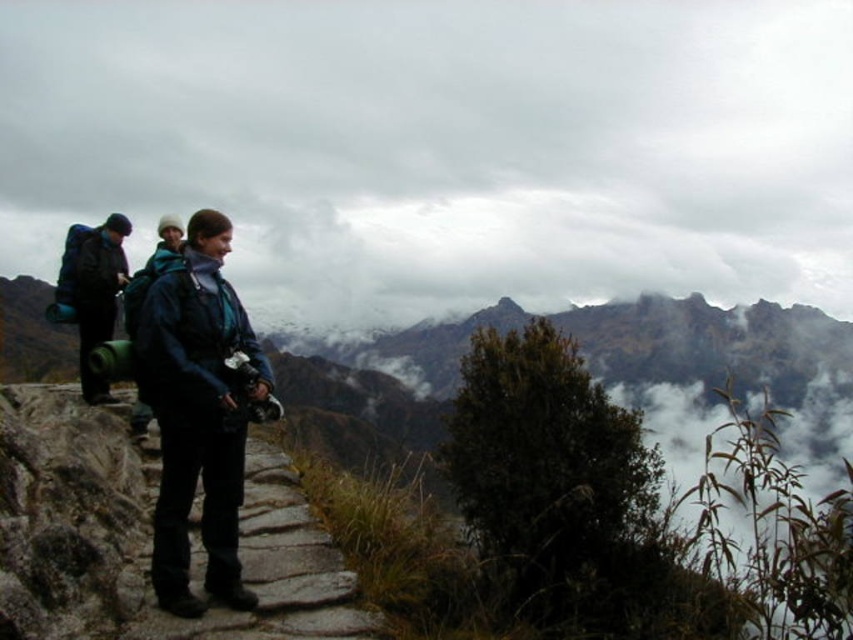
Question: Which object is farther from the camera taking this photo?

Choices:
 (A) stone paved path at center
 (B) dark blue backpack at left

Answer: (B)

Question: Is cloudy sky at upper center above stone paved path at center?

Choices:
 (A) no
 (B) yes

Answer: (B)

Question: Which of these objects is positioned closest to the stone paved path at center?

Choices:
 (A) cloudy sky at upper center
 (B) dark blue backpack at left
 (C) matte blue jacket at center
 (D) green fabric backpack at left

Answer: (C)

Question: Can you confirm if stone paved path at center is wider than dark blue backpack at left?

Choices:
 (A) yes
 (B) no

Answer: (A)

Question: Which object is the closest to the matte blue jacket at center?

Choices:
 (A) green fabric backpack at left
 (B) cloudy sky at upper center
 (C) dark blue backpack at left
 (D) stone paved path at center

Answer: (A)

Question: Can you confirm if matte blue jacket at center is thinner than green fabric backpack at left?

Choices:
 (A) no
 (B) yes

Answer: (A)